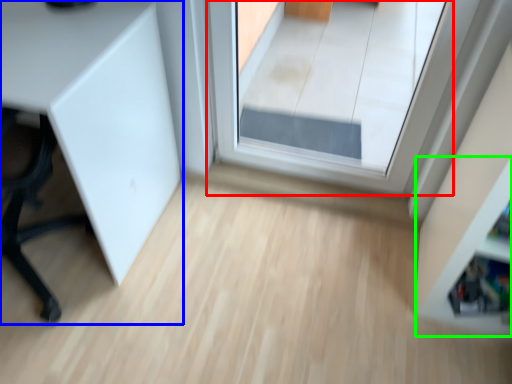
Question: Considering the real-world distances, which object is closest to window (highlighted by a red box)? furniture (highlighted by a blue box) or shelf (highlighted by a green box).

Choices:
 (A) furniture
 (B) shelf

Answer: (A)